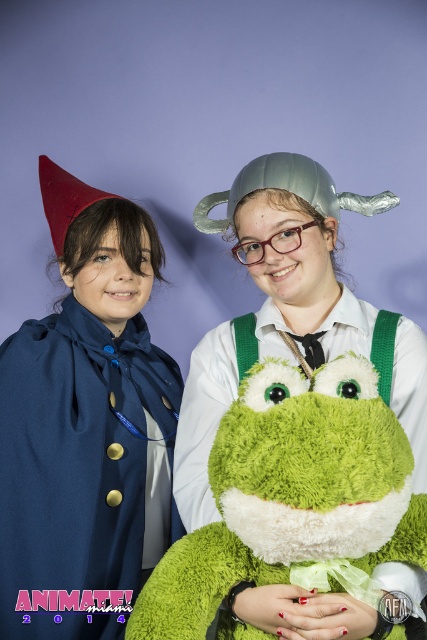
You are a photographer setting up for a photo shoot. You need to position a light source so that it illuminates both the matte blue cape at left and the green plush frog at center without casting shadows on the background. Given their positions, where should you place the light source relative to the subjects?

The matte blue cape at left is above the green plush frog at center, so placing the light source above and slightly behind the subjects would ensure both are illuminated while avoiding shadows on the background.

In the scene shown: You are a photographer standing 1 meter away from the camera. You want to adjust the focus ring on the matte blue cape at left. Can you reach it without moving your position?

The matte blue cape at left and camera are 1.26 meters apart. Since you are 1 meter away from the camera, the distance between you and the matte blue cape at left would be 2.26 meters. This is likely too far to reach the cape without moving.

You are a photographer setting up for a photoshoot. You need to ensure that the matte blue cape at left and the green plush frog at center are both visible in the frame. Given that the camera has a fixed focal length, which object might require you to adjust your position to accommodate its size?

The green plush frog at center requires adjusting your position because it has a greater width than the matte blue cape at left, so you may need to move closer or widen the frame to include it fully.